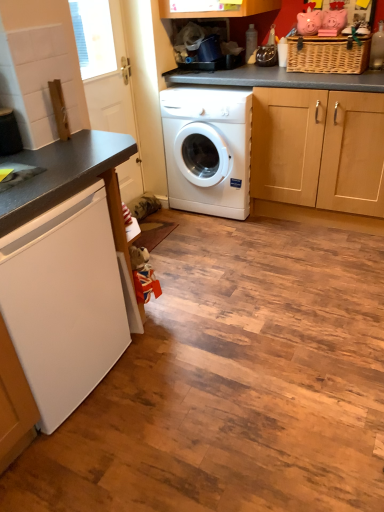
In order to face white matte refrigerator at lower left, which is counted as the second washing machine, starting from the back, should I rotate leftwards or rightwards?

To align with it, rotate left about 21.528°.

How much space does white glossy washing machine at center, the 1th washing machine from the right, occupy horizontally?

white glossy washing machine at center, the 1th washing machine from the right, is 14.97 inches in width.

The width and height of the screenshot is (384, 512). What do you see at coordinates (328, 54) in the screenshot?
I see `woven brown basket at upper right` at bounding box center [328, 54].

The height and width of the screenshot is (512, 384). I want to click on white matte refrigerator at lower left, the second washing machine viewed from the right, so click(64, 302).

Is point (33, 294) positioned behind point (171, 199)?

No, it is in front of (171, 199).

Is white matte refrigerator at lower left, acting as the first washing machine starting from the left, further to the viewer compared to white glossy washing machine at center, arranged as the second washing machine when viewed from the front?

No.

How many degrees apart are the facing directions of white matte refrigerator at lower left, the second washing machine viewed from the right, and white glossy washing machine at center, arranged as the second washing machine when viewed from the front?

white matte refrigerator at lower left, the second washing machine viewed from the right, and white glossy washing machine at center, arranged as the second washing machine when viewed from the front, are facing 87.9 degrees away from each other.

Considering the relative positions of white matte refrigerator at lower left, acting as the 1th washing machine starting from the front, and white glossy washing machine at center, which ranks as the 2th washing machine in bottom-to-top order, in the image provided, is white matte refrigerator at lower left, acting as the 1th washing machine starting from the front, to the left of white glossy washing machine at center, which ranks as the 2th washing machine in bottom-to-top order, from the viewer's perspective?

Yes, white matte refrigerator at lower left, acting as the 1th washing machine starting from the front, is to the left of white glossy washing machine at center, which ranks as the 2th washing machine in bottom-to-top order.

From the image's perspective, which one is positioned lower, white glossy door at upper left or white glossy washing machine at center, marked as the 1th washing machine in a back-to-front arrangement?

white glossy washing machine at center, marked as the 1th washing machine in a back-to-front arrangement, from the image's perspective.

Looking at this image, between white glossy door at upper left and white glossy washing machine at center, which ranks as the 2th washing machine in bottom-to-top order, which one has larger size?

With larger size is white glossy washing machine at center, which ranks as the 2th washing machine in bottom-to-top order.

Considering the sizes of white glossy door at upper left and white glossy washing machine at center, arranged as the 1th washing machine when viewed from the top, in the image, is white glossy door at upper left taller or shorter than white glossy washing machine at center, arranged as the 1th washing machine when viewed from the top,?

white glossy door at upper left is taller than white glossy washing machine at center, arranged as the 1th washing machine when viewed from the top.

Relative to white glossy washing machine at center, arranged as the 1th washing machine when viewed from the top, is white glossy door at upper left in front or behind?

In the image, white glossy door at upper left appears in front of white glossy washing machine at center, arranged as the 1th washing machine when viewed from the top.

Considering the positions of objects white glossy washing machine at center, arranged as the 1th washing machine when viewed from the top, and woven brown basket at upper right in the image provided, who is more to the left, white glossy washing machine at center, arranged as the 1th washing machine when viewed from the top, or woven brown basket at upper right?

→ From the viewer's perspective, white glossy washing machine at center, arranged as the 1th washing machine when viewed from the top, appears more on the left side.

Is white glossy washing machine at center, arranged as the second washing machine when viewed from the left, not close to woven brown basket at upper right?

white glossy washing machine at center, arranged as the second washing machine when viewed from the left, is near woven brown basket at upper right, not far away.

Considering the points (217, 208) and (320, 46), which point is in front, point (217, 208) or point (320, 46)?

Positioned in front is point (320, 46).

Looking at this image, between white glossy washing machine at center, the 1th washing machine from the right, and woven brown basket at upper right, which one has larger width?

white glossy washing machine at center, the 1th washing machine from the right, is wider.

Considering the sizes of white glossy washing machine at center, arranged as the 1th washing machine when viewed from the top, and white matte refrigerator at lower left, the second washing machine viewed from the right, in the image, is white glossy washing machine at center, arranged as the 1th washing machine when viewed from the top, bigger or smaller than white matte refrigerator at lower left, the second washing machine viewed from the right,?

Clearly, white glossy washing machine at center, arranged as the 1th washing machine when viewed from the top, is smaller in size than white matte refrigerator at lower left, the second washing machine viewed from the right.

Would you say white glossy washing machine at center, arranged as the second washing machine when viewed from the front, is a long distance from white matte refrigerator at lower left, positioned as the 2th washing machine in top-to-bottom order?

Yes, white glossy washing machine at center, arranged as the second washing machine when viewed from the front, and white matte refrigerator at lower left, positioned as the 2th washing machine in top-to-bottom order, are quite far apart.

From the image's perspective, relative to white matte refrigerator at lower left, acting as the 1th washing machine starting from the front, is white glossy washing machine at center, the 1th washing machine from the right, above or below?

Based on their image positions, white glossy washing machine at center, the 1th washing machine from the right, is located above white matte refrigerator at lower left, acting as the 1th washing machine starting from the front.

Can you tell me how much white glossy washing machine at center, which ranks as the 2th washing machine in bottom-to-top order, and white matte refrigerator at lower left, arranged as the first washing machine when ordered from the bottom, differ in facing direction?

white glossy washing machine at center, which ranks as the 2th washing machine in bottom-to-top order, and white matte refrigerator at lower left, arranged as the first washing machine when ordered from the bottom, are facing 87.9 degrees away from each other.

Could white matte refrigerator at lower left, arranged as the first washing machine when ordered from the bottom, be considered to be inside woven brown basket at upper right?

No, white matte refrigerator at lower left, arranged as the first washing machine when ordered from the bottom, is located outside of woven brown basket at upper right.

Is point (340, 72) closer to camera compared to point (91, 265)?

No, it is not.

Does woven brown basket at upper right turn towards white matte refrigerator at lower left, the second washing machine viewed from the right?

No, woven brown basket at upper right is not turned towards white matte refrigerator at lower left, the second washing machine viewed from the right.

Which is more to the left, woven brown basket at upper right or white matte refrigerator at lower left, which is counted as the second washing machine, starting from the back?

white matte refrigerator at lower left, which is counted as the second washing machine, starting from the back, is more to the left.

Based on the photo, is white matte refrigerator at lower left, the second washing machine viewed from the right, located within white glossy door at upper left?

No.

Is the depth of white glossy door at upper left less than that of white matte refrigerator at lower left, positioned as the 2th washing machine in top-to-bottom order?

No, it is not.

In the scene shown: Which object is positioned more to the left, white glossy door at upper left or white matte refrigerator at lower left, arranged as the first washing machine when ordered from the bottom?

From the viewer's perspective, white matte refrigerator at lower left, arranged as the first washing machine when ordered from the bottom, appears more on the left side.

From a real-world perspective, relative to woven brown basket at upper right, is white glossy door at upper left vertically above or below?

From a real-world perspective, white glossy door at upper left is physically below woven brown basket at upper right.

Which is nearer, (134, 159) or (337, 66)?

Point (134, 159) is farther from the camera than point (337, 66).

From the image's perspective, is white glossy door at upper left positioned above or below woven brown basket at upper right?

Based on their image positions, white glossy door at upper left is located beneath woven brown basket at upper right.

Is woven brown basket at upper right completely or partially inside white glossy door at upper left?

No, woven brown basket at upper right is not a part of white glossy door at upper left.

Where is `washing machine on the left of the white glossy washing machine at center, arranged as the 1th washing machine when viewed from the top`? washing machine on the left of the white glossy washing machine at center, arranged as the 1th washing machine when viewed from the top is located at coordinates (64, 302).

Find the location of `screen door above the white glossy washing machine at center, arranged as the second washing machine when viewed from the front (from the image's perspective)`. screen door above the white glossy washing machine at center, arranged as the second washing machine when viewed from the front (from the image's perspective) is located at coordinates (104, 65).

Considering their positions, is white matte refrigerator at lower left, the second washing machine viewed from the right, positioned further to woven brown basket at upper right than white glossy door at upper left?

Based on the image, white matte refrigerator at lower left, the second washing machine viewed from the right, appears to be further to woven brown basket at upper right.

Based on their spatial positions, is woven brown basket at upper right or white glossy door at upper left further from white matte refrigerator at lower left, which is counted as the second washing machine, starting from the back?

Based on the image, woven brown basket at upper right appears to be further to white matte refrigerator at lower left, which is counted as the second washing machine, starting from the back.

Estimate the real-world distances between objects in this image. Which object is further from white glossy washing machine at center, arranged as the second washing machine when viewed from the front, woven brown basket at upper right or white matte refrigerator at lower left, the second washing machine viewed from the right?

white matte refrigerator at lower left, the second washing machine viewed from the right.

Looking at this image, looking at the image, which one is located further to white matte refrigerator at lower left, arranged as the first washing machine when ordered from the bottom, white glossy washing machine at center, marked as the 1th washing machine in a back-to-front arrangement, or woven brown basket at upper right?

woven brown basket at upper right lies further to white matte refrigerator at lower left, arranged as the first washing machine when ordered from the bottom, than the other object.

Considering their positions, is white matte refrigerator at lower left, acting as the first washing machine starting from the left, positioned closer to white glossy washing machine at center, marked as the 1th washing machine in a back-to-front arrangement, than white glossy door at upper left?

The object closer to white glossy washing machine at center, marked as the 1th washing machine in a back-to-front arrangement, is white glossy door at upper left.

Considering their positions, is woven brown basket at upper right positioned further to white matte refrigerator at lower left, positioned as the 2th washing machine in top-to-bottom order, than white glossy washing machine at center, arranged as the 1th washing machine when viewed from the top?

woven brown basket at upper right.

Looking at the image, which one is located further to white glossy washing machine at center, which ranks as the 2th washing machine in bottom-to-top order, white matte refrigerator at lower left, acting as the first washing machine starting from the left, or woven brown basket at upper right?

white matte refrigerator at lower left, acting as the first washing machine starting from the left.

Consider the image. Which object lies further to the anchor point white glossy washing machine at center, which ranks as the 2th washing machine in bottom-to-top order, white glossy door at upper left or woven brown basket at upper right?

Based on the image, woven brown basket at upper right appears to be further to white glossy washing machine at center, which ranks as the 2th washing machine in bottom-to-top order.

In order to click on washing machine situated between white matte refrigerator at lower left, acting as the first washing machine starting from the left, and woven brown basket at upper right from left to right in this screenshot , I will do `click(208, 149)`.

The width and height of the screenshot is (384, 512). Find the location of `screen door between white matte refrigerator at lower left, arranged as the first washing machine when ordered from the bottom, and woven brown basket at upper right from left to right`. screen door between white matte refrigerator at lower left, arranged as the first washing machine when ordered from the bottom, and woven brown basket at upper right from left to right is located at coordinates (104, 65).

You are a GUI agent. You are given a task and a screenshot of the screen. Output one action in this format:
    pyautogui.click(x=<x>, y=<y>)
    Task: Click on the washing machine between white glossy door at upper left and woven brown basket at upper right
    Image resolution: width=384 pixels, height=512 pixels.
    Given the screenshot: What is the action you would take?
    pyautogui.click(x=208, y=149)

Image resolution: width=384 pixels, height=512 pixels. Identify the location of screen door between white matte refrigerator at lower left, the second washing machine viewed from the right, and white glossy washing machine at center, arranged as the 1th washing machine when viewed from the top, from front to back. (104, 65).